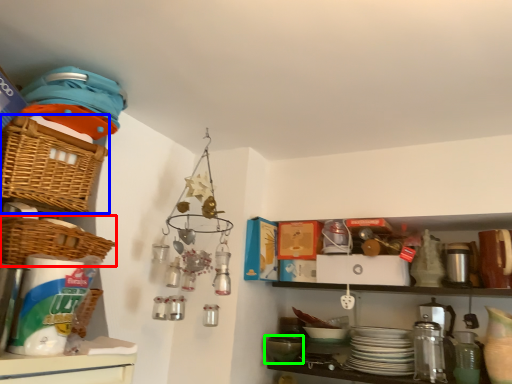
Question: Based on their relative distances, which object is nearer to basket (highlighted by a red box)? Choose from basket (highlighted by a blue box) and mixing bowl (highlighted by a green box).

Choices:
 (A) basket
 (B) mixing bowl

Answer: (A)